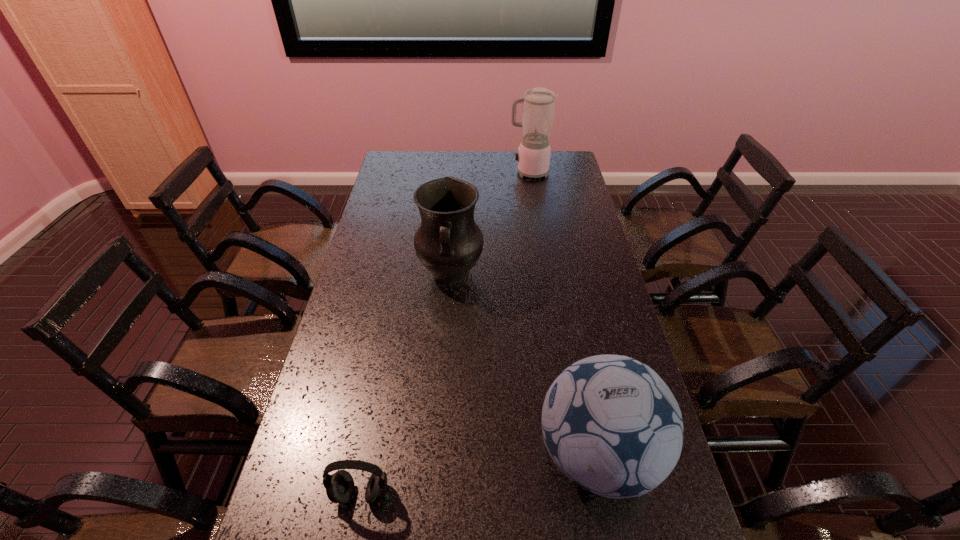
Locate an element on the screen. The width and height of the screenshot is (960, 540). the tallest object is located at coordinates (533, 157).

Find the location of `food processor`. food processor is located at coordinates (533, 157).

Find the location of a particular element. the third nearest object is located at coordinates (448, 243).

You are a GUI agent. You are given a task and a screenshot of the screen. Output one action in this format:
    pyautogui.click(x=<x>, y=<y>)
    Task: Click on the soccer ball
    
    Given the screenshot: What is the action you would take?
    pyautogui.click(x=610, y=423)

Find the location of a particular element. Image resolution: width=960 pixels, height=540 pixels. headset is located at coordinates (340, 486).

Where is `vacant space located on the base of the farthest object near the control knob`? vacant space located on the base of the farthest object near the control knob is located at coordinates (482, 172).

I want to click on vacant space positioned 0.310m on the base of the farthest object near the control knob, so click(x=441, y=172).

Find the location of a particular element. The height and width of the screenshot is (540, 960). free space located 0.180m on the base of the farthest object near the control knob is located at coordinates [468, 172].

Where is `vacant region located on the handle side of the pitcher`? Image resolution: width=960 pixels, height=540 pixels. vacant region located on the handle side of the pitcher is located at coordinates (446, 326).

Where is `free space located 0.060m on the side with brand of the soccer ball`? This screenshot has width=960, height=540. free space located 0.060m on the side with brand of the soccer ball is located at coordinates (511, 455).